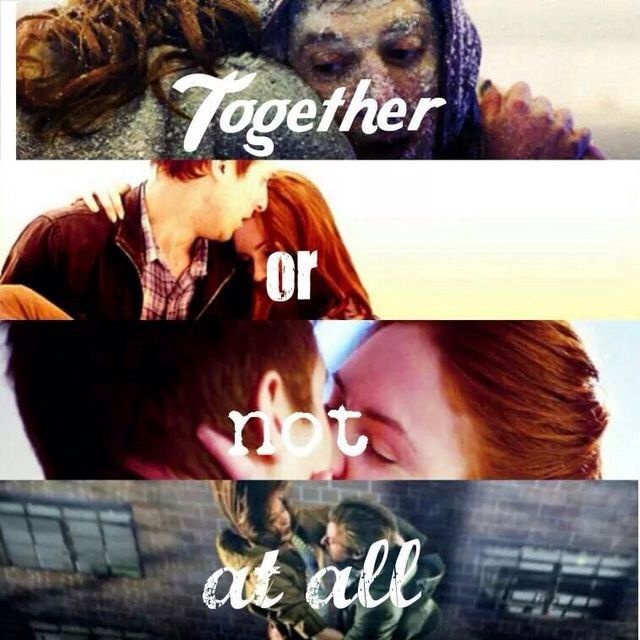
Locate an element on the screen. Image resolution: width=640 pixels, height=640 pixels. windows is located at coordinates (112, 545), (523, 588).